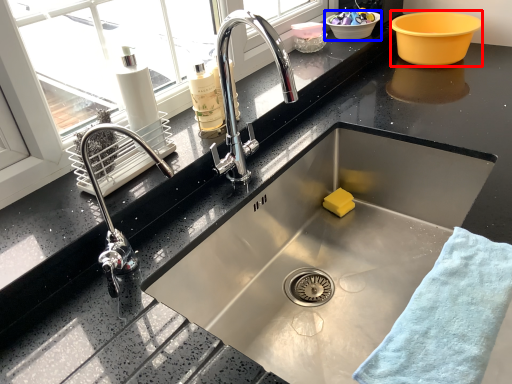
Question: Which object appears farthest to the camera in this image, basin (highlighted by a red box) or basin (highlighted by a blue box)?

Choices:
 (A) basin
 (B) basin

Answer: (B)